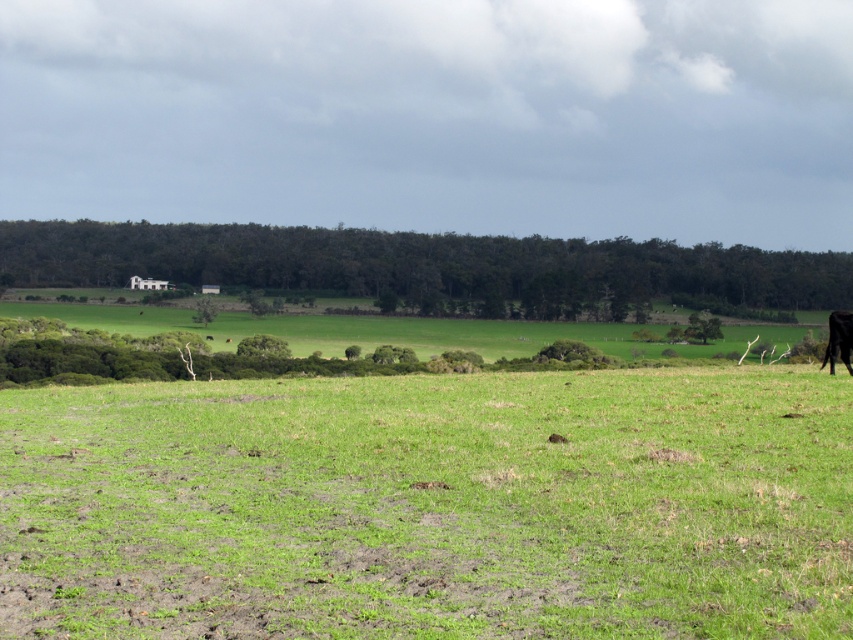
Question: Does green grassy pasture at center lie behind black fur at right?

Choices:
 (A) no
 (B) yes

Answer: (A)

Question: Which object is positioned closest to the green grassy pasture at center?

Choices:
 (A) green grassy hillside at upper center
 (B) black fur at right

Answer: (B)

Question: Is green grassy pasture at center to the right of black fur at right from the viewer's perspective?

Choices:
 (A) yes
 (B) no

Answer: (B)

Question: Estimate the real-world distances between objects in this image. Which object is farther from the black fur at right?

Choices:
 (A) green grassy hillside at upper center
 (B) green grassy pasture at center

Answer: (A)

Question: Can you confirm if green grassy hillside at upper center is bigger than black fur at right?

Choices:
 (A) yes
 (B) no

Answer: (A)

Question: Estimate the real-world distances between objects in this image. Which object is closer to the green grassy pasture at center?

Choices:
 (A) green grassy hillside at upper center
 (B) black fur at right

Answer: (B)